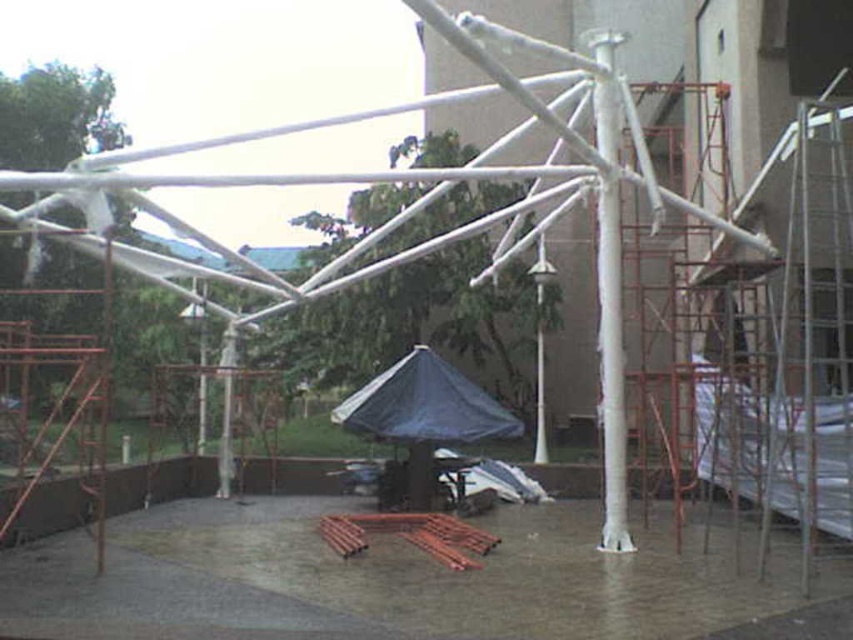
Question: Does white plastic pole at center come behind dark blue tarp at center?

Choices:
 (A) yes
 (B) no

Answer: (B)

Question: Which of the following is the farthest from the observer?

Choices:
 (A) white plastic pole at center
 (B) dark blue tarp at center

Answer: (B)

Question: Is white plastic pole at center wider than dark blue tarp at center?

Choices:
 (A) no
 (B) yes

Answer: (B)

Question: From the image, what is the correct spatial relationship of white plastic pole at center in relation to dark blue tarp at center?

Choices:
 (A) above
 (B) below

Answer: (A)